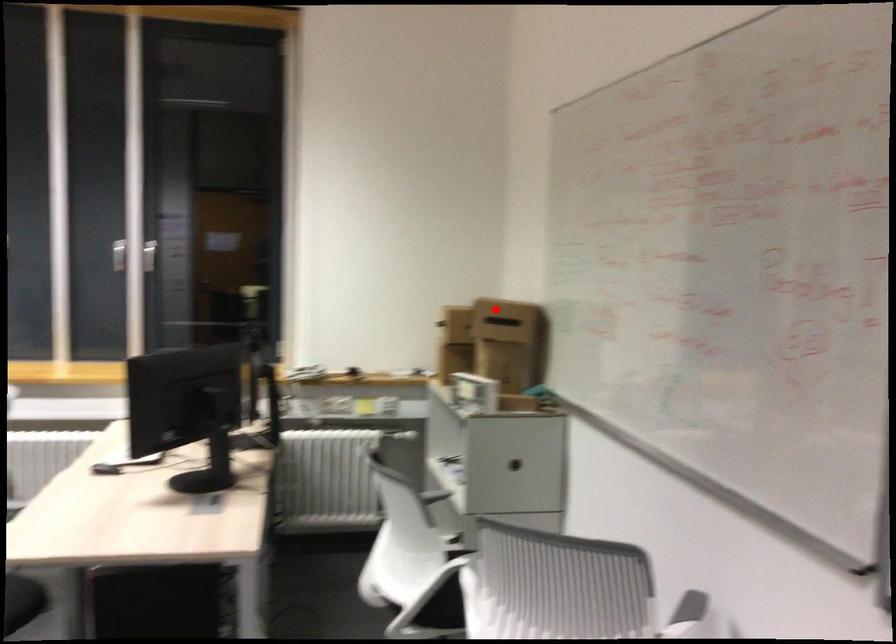
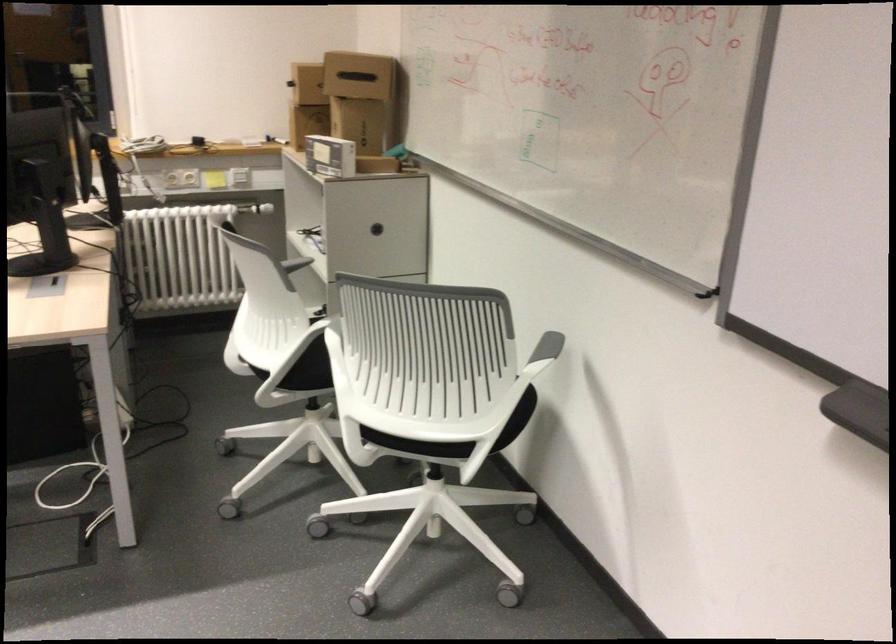
Where in the second image is the point corresponding to the highlighted location from the first image?

(358, 75)